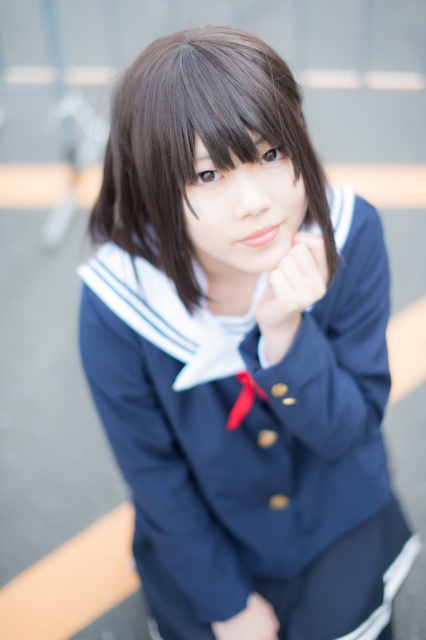
Question: Does matte skin hand at center have a greater width compared to matte skin hand at lower center?

Choices:
 (A) yes
 (B) no

Answer: (B)

Question: Estimate the real-world distances between objects in this image. Which object is farther from the matte skin hand at center?

Choices:
 (A) matte skin hand at lower center
 (B) semi-glossy dark brown hair at center

Answer: (A)

Question: Does semi-glossy dark brown hair at center come behind matte skin hand at center?

Choices:
 (A) no
 (B) yes

Answer: (A)

Question: Based on their relative distances, which object is nearer to the matte skin hand at lower center?

Choices:
 (A) semi-glossy dark brown hair at center
 (B) matte skin hand at center

Answer: (B)

Question: Is semi-glossy dark brown hair at center above matte skin hand at center?

Choices:
 (A) yes
 (B) no

Answer: (A)

Question: Which object is positioned farthest from the semi-glossy dark brown hair at center?

Choices:
 (A) matte skin hand at center
 (B) matte skin hand at lower center

Answer: (B)